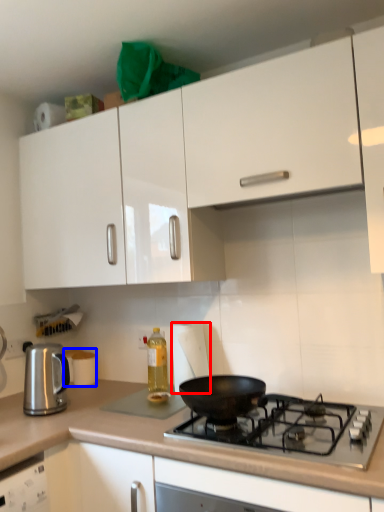
Question: Which of the following is the farthest to the observer, paper towel (highlighted by a red box) or appliance (highlighted by a blue box)?

Choices:
 (A) paper towel
 (B) appliance

Answer: (B)